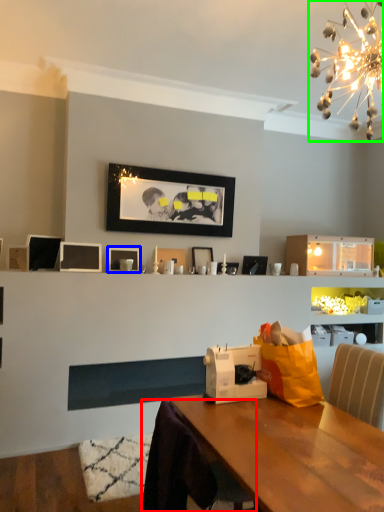
Question: Considering the real-world distances, which object is closest to swivel chair (highlighted by a red box)? picture frame (highlighted by a blue box) or light fixture (highlighted by a green box).

Choices:
 (A) picture frame
 (B) light fixture

Answer: (A)